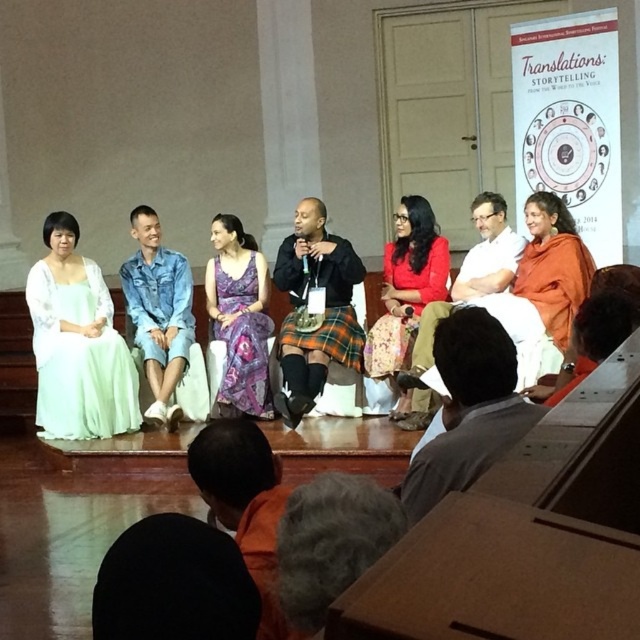
You are organizing a panel discussion and need to ensure that all participants have enough space between them. Given that the denim jacket at center and the matte orange robe at center are seated next to each other, which participant requires more space due to their clothing?

The matte orange robe at center requires more space because its width is greater than the denim jacket at center.

Based on the photo, based on the scene description, where is the light green satin dress at left located in terms of its 2D coordinates?

The light green satin dress at left is located at the 2D coordinates point (x=80, y=358).